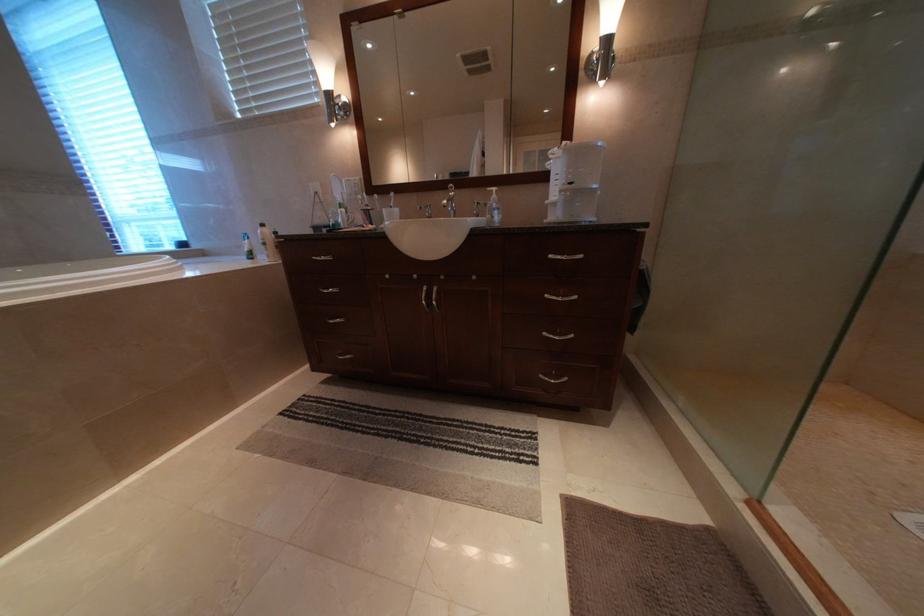
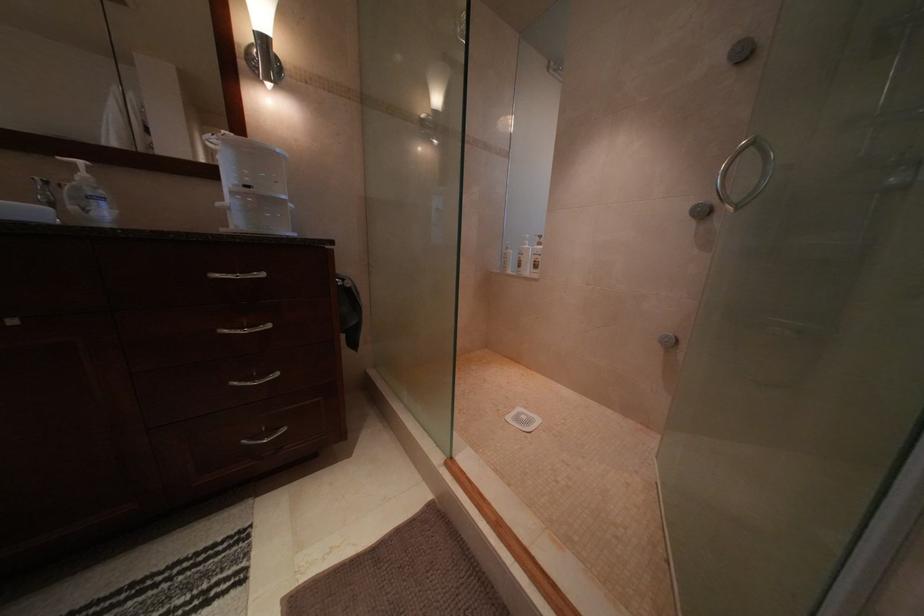
Question: Based on the continuous images, in which direction is the camera rotating? Reply with the corresponding letter.

Choices:
 (A) Left
 (B) Right
 (C) Up
 (D) Down

Answer: (B)